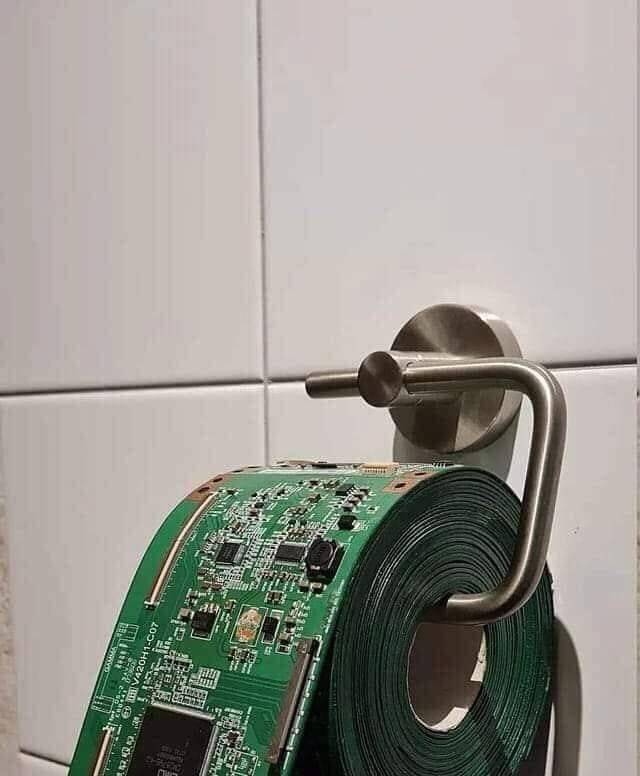
What are the coordinates of `concrete wall on the left of the tile on the bottom left edge of the photo` in the screenshot? It's located at (8, 749).